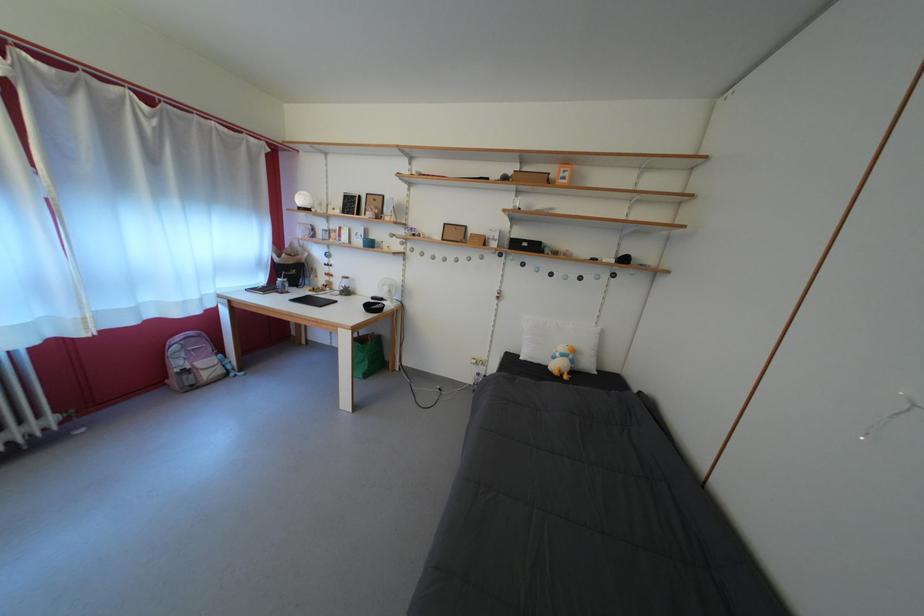
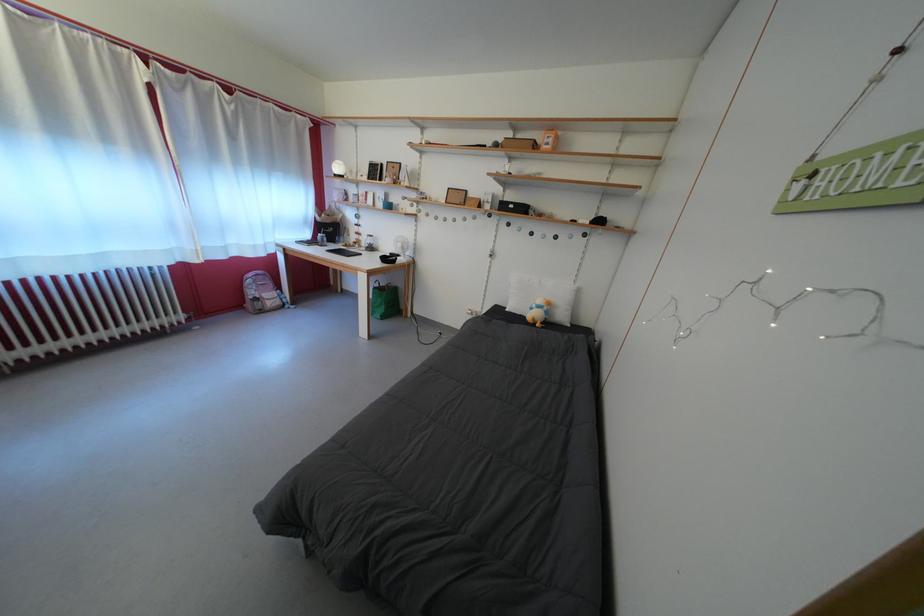
Question: I am providing you with two images of the same scene from different viewpoints. After the viewpoint changes to image2, which objects are now occluded?

Choices:
 (A) white pillow
 (B) small black box
 (C) stuffed toy duck
 (D) none of these

Answer: (D)